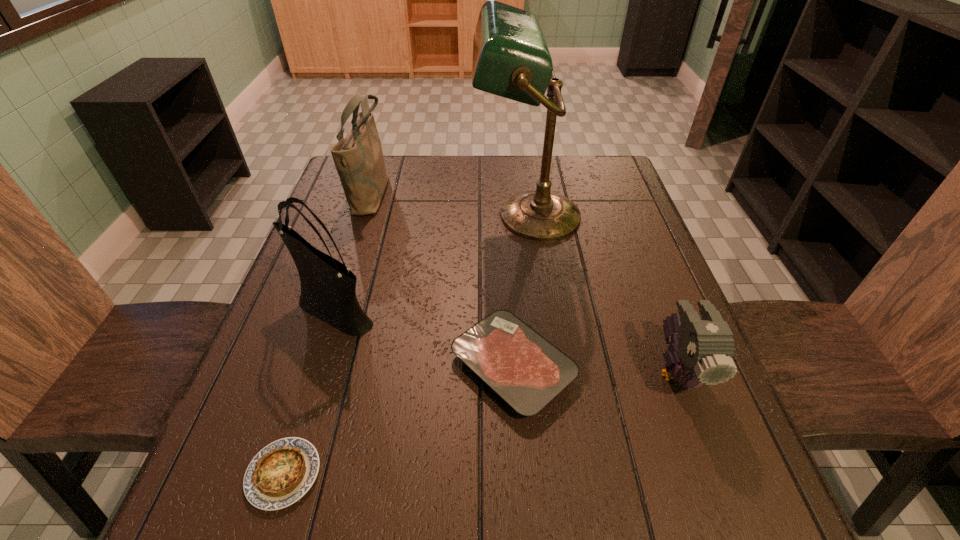
Locate an element on the screen. The width and height of the screenshot is (960, 540). object located in the right edge section of the desktop is located at coordinates (702, 352).

Locate an element on the screen. Image resolution: width=960 pixels, height=540 pixels. object at the far left corner is located at coordinates (358, 157).

Find the location of `object located at the near left corner`. object located at the near left corner is located at coordinates (280, 474).

Locate an element on the screen. free location at the far edge is located at coordinates (533, 190).

Image resolution: width=960 pixels, height=540 pixels. In the image, there is a desktop. What are the coordinates of `vacant area at the near edge` in the screenshot? It's located at (359, 519).

Locate an element on the screen. Image resolution: width=960 pixels, height=540 pixels. free region at the left edge of the desktop is located at coordinates (356, 273).

You are a GUI agent. You are given a task and a screenshot of the screen. Output one action in this format:
    pyautogui.click(x=<x>, y=<y>)
    Task: Click on the vacant space at the right edge
    The width and height of the screenshot is (960, 540).
    Given the screenshot: What is the action you would take?
    pyautogui.click(x=634, y=287)

Identify the location of free space at the near right corner of the desktop. (741, 507).

In order to click on empty location between the quiche and the steak in this screenshot , I will do `click(398, 420)`.

Locate an element on the screen. The width and height of the screenshot is (960, 540). blank region between the farther shoulder bag and the nearer shoulder bag is located at coordinates (351, 251).